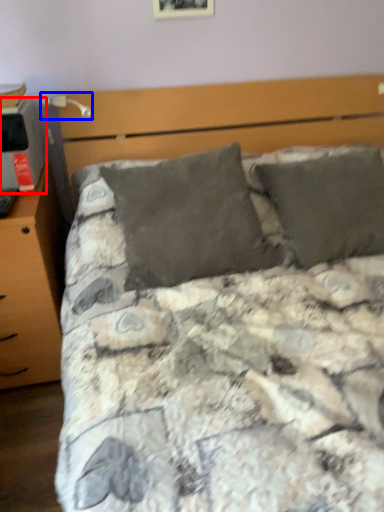
Question: Which object is further to the camera taking this photo, desktop (highlighted by a red box) or table lamp (highlighted by a blue box)?

Choices:
 (A) desktop
 (B) table lamp

Answer: (B)